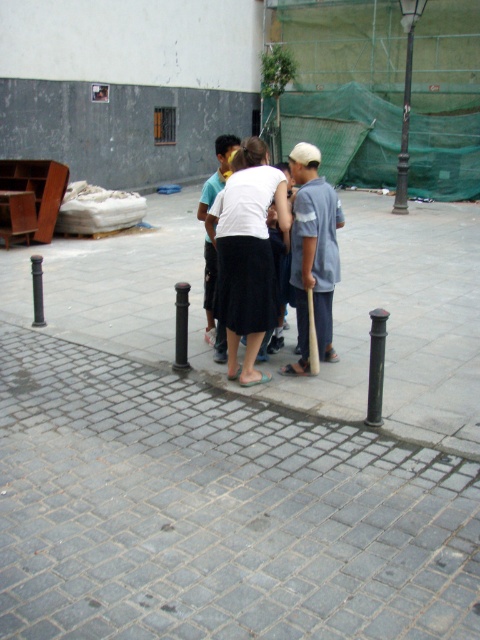
Question: Can you confirm if gray cobblestone pavement at center is positioned below white matte skirt at center?

Choices:
 (A) no
 (B) yes

Answer: (B)

Question: Which point is farther to the camera?

Choices:
 (A) (32, 276)
 (B) (235, 180)
 (C) (407, 83)
 (D) (314, 323)

Answer: (C)

Question: Among these objects, which one is nearest to the camera?

Choices:
 (A) wooden baseball bat at center
 (B) black polished pillar at center

Answer: (A)

Question: Which object is the closest to the black polished pillar at center?

Choices:
 (A) wooden baseball bat at center
 (B) gray cobblestone pavement at center
 (C) light blue cotton shirt at center

Answer: (A)

Question: Does bronze textured pole at upper right have a smaller size compared to black polished pillar at center?

Choices:
 (A) no
 (B) yes

Answer: (B)

Question: From the image, what is the correct spatial relationship of black metal pole at center in relation to black metal pole at left?

Choices:
 (A) above
 (B) below

Answer: (B)